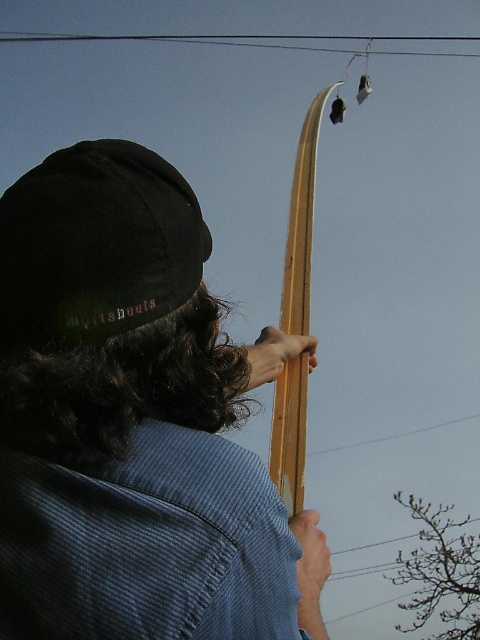
Can you confirm if wooden pole at center is positioned above black wire at upper center?

No, wooden pole at center is not above black wire at upper center.

Is wooden pole at center wider than black wire at upper center?

No, wooden pole at center is not wider than black wire at upper center.

Is point (294, 220) positioned before point (328, 38)?

Yes, point (294, 220) is in front of point (328, 38).

The width and height of the screenshot is (480, 640). In order to click on wooden pole at center in this screenshot , I will do `click(301, 224)`.

Does black cotton baseball hat at upper left have a smaller size compared to wooden pole at center?

Indeed, black cotton baseball hat at upper left has a smaller size compared to wooden pole at center.

Can you confirm if black cotton baseball hat at upper left is taller than wooden pole at center?

Incorrect, black cotton baseball hat at upper left's height is not larger of wooden pole at center's.

Find the location of a particular element. This screenshot has height=640, width=480. black cotton baseball hat at upper left is located at coordinates (96, 244).

Where is `black cotton baseball hat at upper left`? The height and width of the screenshot is (640, 480). black cotton baseball hat at upper left is located at coordinates (96, 244).

Who is more forward, (41, 218) or (370, 36)?

Positioned in front is point (41, 218).

Can you confirm if wooden bow at upper center is positioned below black wire at upper center?

Yes.

Between point (7, 464) and point (299, 35), which one is positioned behind?

Point (299, 35)

The width and height of the screenshot is (480, 640). Identify the location of wooden bow at upper center. (133, 420).